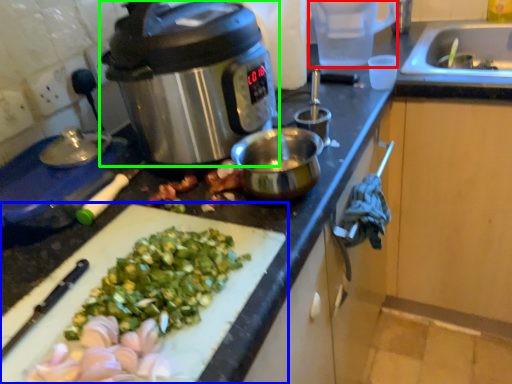
Question: Which object is positioned closest to appliance (highlighted by a red box)? Select from cutting board (highlighted by a blue box) and slow cooker (highlighted by a green box).

Choices:
 (A) cutting board
 (B) slow cooker

Answer: (B)